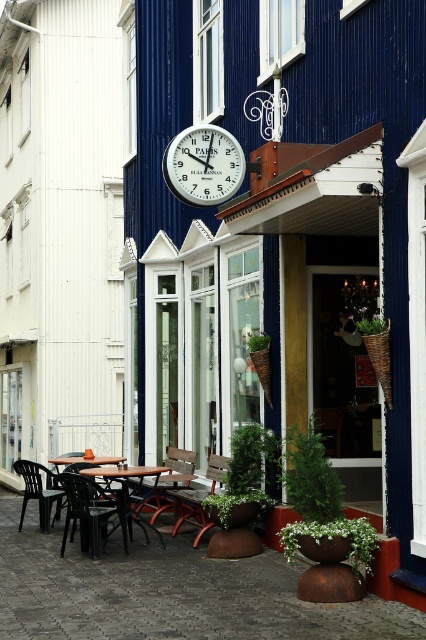
Question: Considering the real-world distances, which object is farthest from the black plastic chair at left?

Choices:
 (A) white plastic clock at center
 (B) wooden table at center
 (C) black plastic chair at lower left

Answer: (A)

Question: Is white plastic clock at center below wooden table at lower left?

Choices:
 (A) no
 (B) yes

Answer: (A)

Question: Which object is the closest to the wooden table at lower left?

Choices:
 (A) black plastic chair at lower left
 (B) wooden table at center
 (C) white plastic clock at center

Answer: (B)

Question: Where is wooden chair at center located in relation to black plastic chair at left in the image?

Choices:
 (A) above
 (B) below

Answer: (A)

Question: Which of the following is the closest to the observer?

Choices:
 (A) brown plastic chair at center
 (B) white plastic clock at center
 (C) black plastic chair at left

Answer: (B)

Question: Can you confirm if black plastic chair at lower left is smaller than wooden chair at center?

Choices:
 (A) yes
 (B) no

Answer: (A)